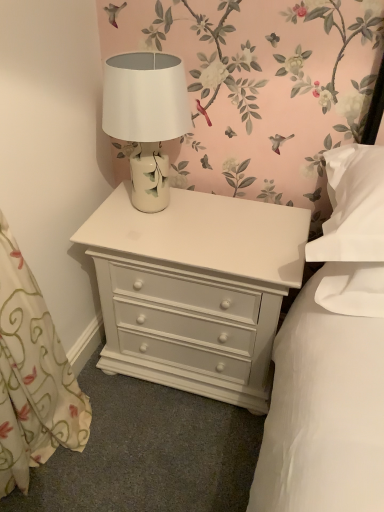
At what (x,y) coordinates should I click in order to perform the action: click on white painted wood nightstand at center. Please return your answer as a coordinate pair (x, y). Looking at the image, I should click on (195, 289).

This screenshot has height=512, width=384. Describe the element at coordinates (195, 289) in the screenshot. I see `white painted wood nightstand at center` at that location.

Where is `white ceramic table lamp at center`? The width and height of the screenshot is (384, 512). white ceramic table lamp at center is located at coordinates (146, 118).

What do you see at coordinates (146, 118) in the screenshot? I see `white ceramic table lamp at center` at bounding box center [146, 118].

Locate an element on the screen. white painted wood nightstand at center is located at coordinates (195, 289).

Is white ceramic table lamp at center to the right of white painted wood nightstand at center from the viewer's perspective?

Incorrect, white ceramic table lamp at center is not on the right side of white painted wood nightstand at center.

Is white ceramic table lamp at center in front of or behind white painted wood nightstand at center in the image?

Clearly, white ceramic table lamp at center is in front of white painted wood nightstand at center.

Does point (144, 154) appear closer or farther from the camera than point (151, 309)?

Clearly, point (144, 154) is closer to the camera than point (151, 309).

From the image's perspective, is white ceramic table lamp at center over white painted wood nightstand at center?

Yes.

From a real-world perspective, is white ceramic table lamp at center positioned over white painted wood nightstand at center based on gravity?

Yes, from a real-world perspective, white ceramic table lamp at center is above white painted wood nightstand at center.

Considering the relative sizes of white ceramic table lamp at center and white painted wood nightstand at center in the image provided, is white ceramic table lamp at center wider than white painted wood nightstand at center?

In fact, white ceramic table lamp at center might be narrower than white painted wood nightstand at center.

Can you confirm if white ceramic table lamp at center is shorter than white painted wood nightstand at center?

Indeed, white ceramic table lamp at center has a lesser height compared to white painted wood nightstand at center.

Considering the sizes of objects white ceramic table lamp at center and white painted wood nightstand at center in the image provided, who is smaller, white ceramic table lamp at center or white painted wood nightstand at center?

Smaller between the two is white ceramic table lamp at center.

Is white painted wood nightstand at center located within white ceramic table lamp at center?

No, white painted wood nightstand at center is located outside of white ceramic table lamp at center.

Is white ceramic table lamp at center directly adjacent to white painted wood nightstand at center?

No, white ceramic table lamp at center is not with white painted wood nightstand at center.

Could you tell me if white ceramic table lamp at center is turned towards white painted wood nightstand at center?

No, white ceramic table lamp at center is not facing towards white painted wood nightstand at center.

How many degrees apart are the facing directions of white ceramic table lamp at center and white painted wood nightstand at center?

The angle between the facing direction of white ceramic table lamp at center and the facing direction of white painted wood nightstand at center is 1.82 degrees.

I want to click on table lamp positioned vertically above the white painted wood nightstand at center (from a real-world perspective), so click(x=146, y=118).

Which is more to the left, white painted wood nightstand at center or white ceramic table lamp at center?

white ceramic table lamp at center is more to the left.

Who is more distant, white painted wood nightstand at center or white ceramic table lamp at center?

white painted wood nightstand at center is behind.

Is point (212, 292) positioned after point (180, 71)?

Yes, it is.

From the image's perspective, is white painted wood nightstand at center positioned above or below white ceramic table lamp at center?

Clearly, from the image's perspective, white painted wood nightstand at center is below white ceramic table lamp at center.

From a real-world perspective, is white painted wood nightstand at center above or below white ceramic table lamp at center?

In terms of real-world spatial position, white painted wood nightstand at center is below white ceramic table lamp at center.

Looking at this image, considering the sizes of objects white painted wood nightstand at center and white ceramic table lamp at center in the image provided, who is thinner, white painted wood nightstand at center or white ceramic table lamp at center?

Thinner between the two is white ceramic table lamp at center.

Is white painted wood nightstand at center taller than white ceramic table lamp at center?

Yes, white painted wood nightstand at center is taller than white ceramic table lamp at center.

In terms of size, does white painted wood nightstand at center appear bigger or smaller than white ceramic table lamp at center?

In the image, white painted wood nightstand at center appears to be larger than white ceramic table lamp at center.

Is white ceramic table lamp at center surrounded by white painted wood nightstand at center?

No, white ceramic table lamp at center is not a part of white painted wood nightstand at center.

Is the surface of white painted wood nightstand at center in direct contact with white ceramic table lamp at center?

No, white painted wood nightstand at center is not making contact with white ceramic table lamp at center.

Is white ceramic table lamp at center at the back of white painted wood nightstand at center?

No.

Measure the distance between white painted wood nightstand at center and white ceramic table lamp at center.

They are 31.65 centimeters apart.

The image size is (384, 512). I want to click on nightstand to the right of white ceramic table lamp at center, so click(x=195, y=289).

Where is `table lamp above the white painted wood nightstand at center (from a real-world perspective)`? table lamp above the white painted wood nightstand at center (from a real-world perspective) is located at coordinates (146, 118).

Find the location of a particular element. This screenshot has height=512, width=384. nightstand located on the right of white ceramic table lamp at center is located at coordinates (195, 289).